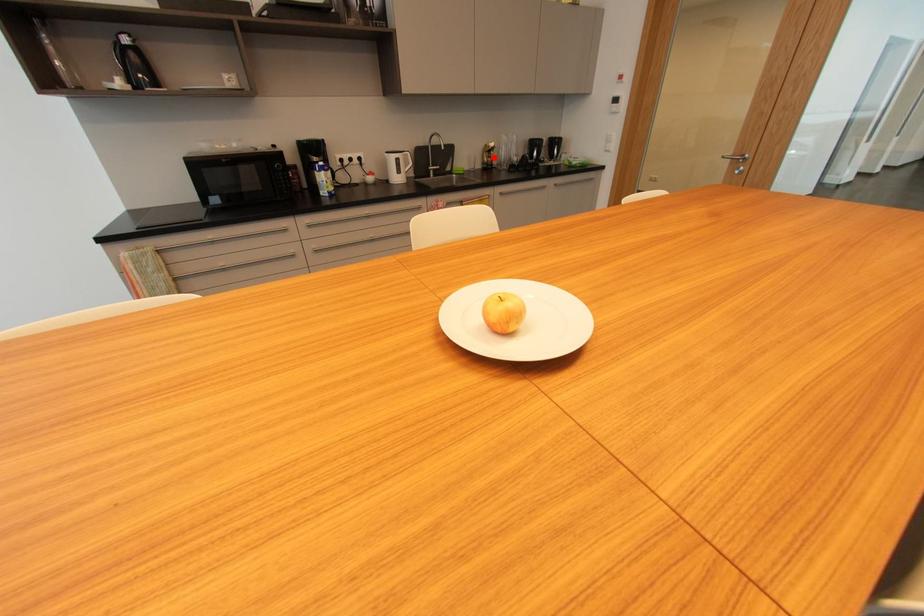
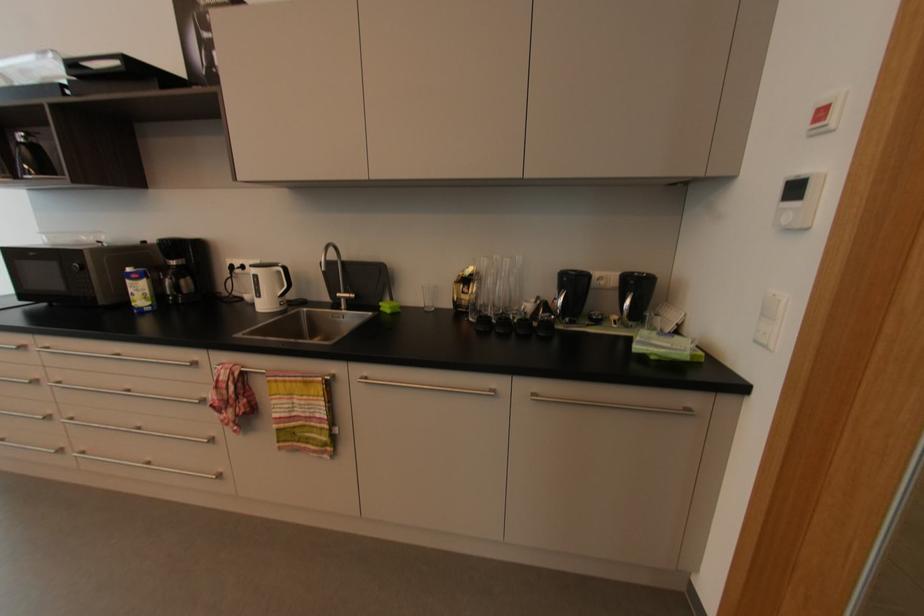
In the second image, find the point that corresponds to the highlighted location in the first image.

(469, 294)